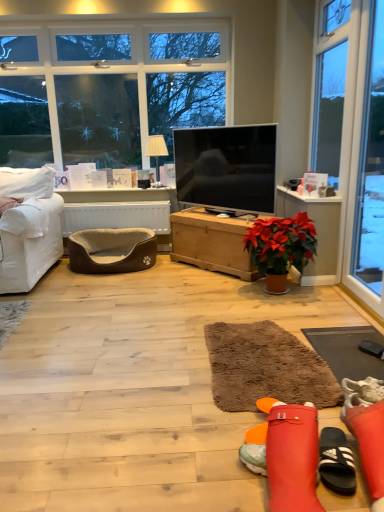
Question: Is brown shaggy rug at center, placed as the first flat when sorted from left to right, positioned behind wooden chest at center, which is the 1th table from right to left?

Choices:
 (A) no
 (B) yes

Answer: (A)

Question: Does brown shaggy rug at center, placed as the first flat when sorted from left to right, come in front of wooden chest at center, the 2th table in the left-to-right sequence?

Choices:
 (A) yes
 (B) no

Answer: (A)

Question: From a real-world perspective, is brown shaggy rug at center, placed as the first flat when sorted from left to right, located higher than wooden chest at center, the 2th table in the left-to-right sequence?

Choices:
 (A) no
 (B) yes

Answer: (A)

Question: Is brown shaggy rug at center, the 2th flat from the right, next to wooden chest at center, the 2th table in the left-to-right sequence?

Choices:
 (A) no
 (B) yes

Answer: (A)

Question: Can you confirm if brown shaggy rug at center, placed as the first flat when sorted from left to right, is positioned to the left of wooden chest at center, which is the 1th table from right to left?

Choices:
 (A) yes
 (B) no

Answer: (B)

Question: Does brown shaggy rug at center, placed as the first flat when sorted from left to right, have a larger size compared to wooden chest at center, which is the 1th table from right to left?

Choices:
 (A) no
 (B) yes

Answer: (A)

Question: Does brown shaggy rug at lower right, which is counted as the 2th flat, starting from the left, have a smaller size compared to transparent glass door at right?

Choices:
 (A) no
 (B) yes

Answer: (B)

Question: Considering the relative sizes of brown shaggy rug at lower right, which is counted as the 2th flat, starting from the left, and transparent glass door at right in the image provided, is brown shaggy rug at lower right, which is counted as the 2th flat, starting from the left, bigger than transparent glass door at right?

Choices:
 (A) yes
 (B) no

Answer: (B)

Question: Considering the relative positions of brown shaggy rug at lower right, the first flat viewed from the right, and transparent glass door at right in the image provided, is brown shaggy rug at lower right, the first flat viewed from the right, to the left of transparent glass door at right from the viewer's perspective?

Choices:
 (A) yes
 (B) no

Answer: (A)

Question: Is brown shaggy rug at lower right, which is counted as the 2th flat, starting from the left, oriented away from transparent glass door at right?

Choices:
 (A) no
 (B) yes

Answer: (A)

Question: Is transparent glass door at right surrounded by brown shaggy rug at lower right, which is counted as the 2th flat, starting from the left?

Choices:
 (A) yes
 (B) no

Answer: (B)

Question: Is brown shaggy rug at lower right, which is counted as the 2th flat, starting from the left, closer to camera compared to transparent glass door at right?

Choices:
 (A) no
 (B) yes

Answer: (B)

Question: Is matte black tv at center not close to brown shaggy rug at center, the 2th flat from the right?

Choices:
 (A) yes
 (B) no

Answer: (A)